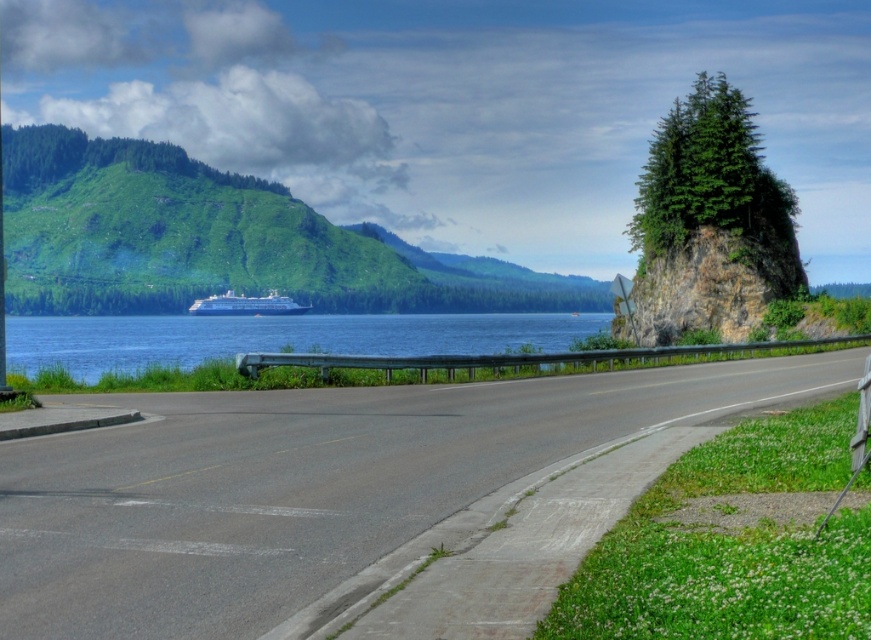
You are a photographer standing on the coastal road. You want to capture a photo that includes both the blue water at center and the metallic reflective sign at upper right. Given that your camera can focus on objects within a 100 meter range, will both objects be in focus?

The distance between the blue water at center and the metallic reflective sign at upper right is 75.14 meters, which is within the camera focus range of 100 meters. Therefore, both objects will be in focus.

You are a tourist driving along the coastal road and notice the asphalt road at center and the metallic reflective sign at upper right. Which of these two objects takes up more area in the image?

The metallic reflective sign at upper right occupies more space than the asphalt road at center in the image.